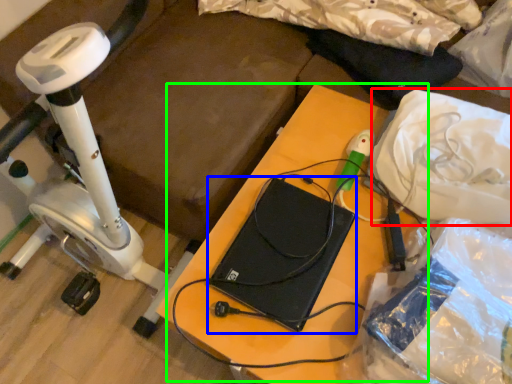
Question: Which object is the closest to the material (highlighted by a red box)? Choose among these: computer (highlighted by a blue box) or table (highlighted by a green box).

Choices:
 (A) computer
 (B) table

Answer: (B)